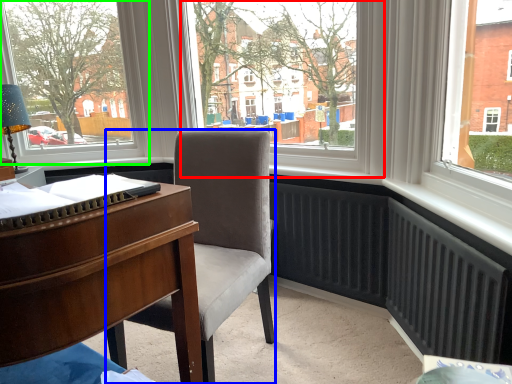
Question: Estimate the real-world distances between objects in this image. Which object is closer to window screen (highlighted by a red box), chair (highlighted by a blue box) or window (highlighted by a green box)?

Choices:
 (A) chair
 (B) window

Answer: (A)